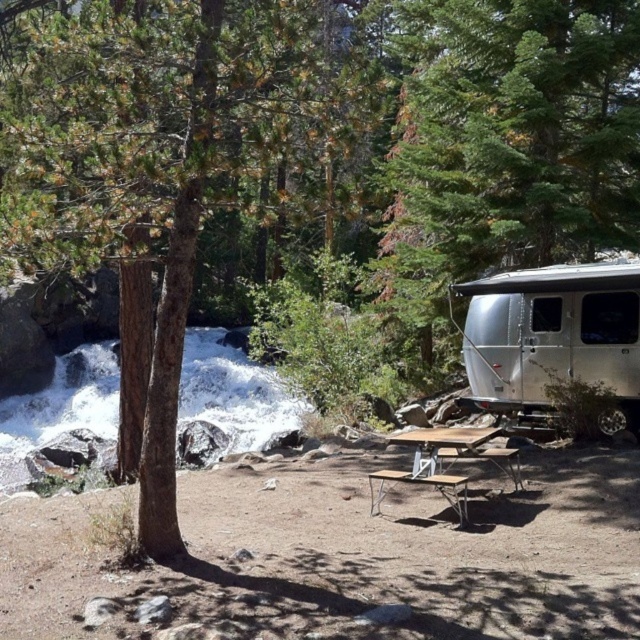
Can you confirm if brown rough tree at center is taller than silver metallic trailer at right?

Yes, brown rough tree at center is taller than silver metallic trailer at right.

Is point (72, 97) less distant than point (634, 369)?

Yes, it is in front of point (634, 369).

What do you see at coordinates (156, 170) in the screenshot?
I see `brown rough tree at center` at bounding box center [156, 170].

Identify the location of brown rough tree at center. (156, 170).

Who is shorter, brown rough tree at center or brown wood picnic table at center?

brown wood picnic table at center

Is brown rough tree at center wider than brown wood picnic table at center?

Yes, brown rough tree at center is wider than brown wood picnic table at center.

Does point (49, 166) come behind point (460, 444)?

No, it is not.

You are a GUI agent. You are given a task and a screenshot of the screen. Output one action in this format:
    pyautogui.click(x=<x>, y=<y>)
    Task: Click on the brown rough tree at center
    This screenshot has width=640, height=640.
    Given the screenshot: What is the action you would take?
    pyautogui.click(x=156, y=170)

Who is more forward, (513, 116) or (600, 432)?

Point (600, 432) is more forward.

Does silver metallic camper at right have a greater width compared to silver metallic trailer at right?

Incorrect, silver metallic camper at right's width does not surpass silver metallic trailer at right's.

Is point (468, 83) closer to viewer compared to point (490, 333)?

No, (468, 83) is behind (490, 333).

You are a GUI agent. You are given a task and a screenshot of the screen. Output one action in this format:
    pyautogui.click(x=<x>, y=<y>)
    Task: Click on the silver metallic camper at right
    Image resolution: width=640 pixels, height=640 pixels.
    Given the screenshot: What is the action you would take?
    pyautogui.click(x=508, y=141)